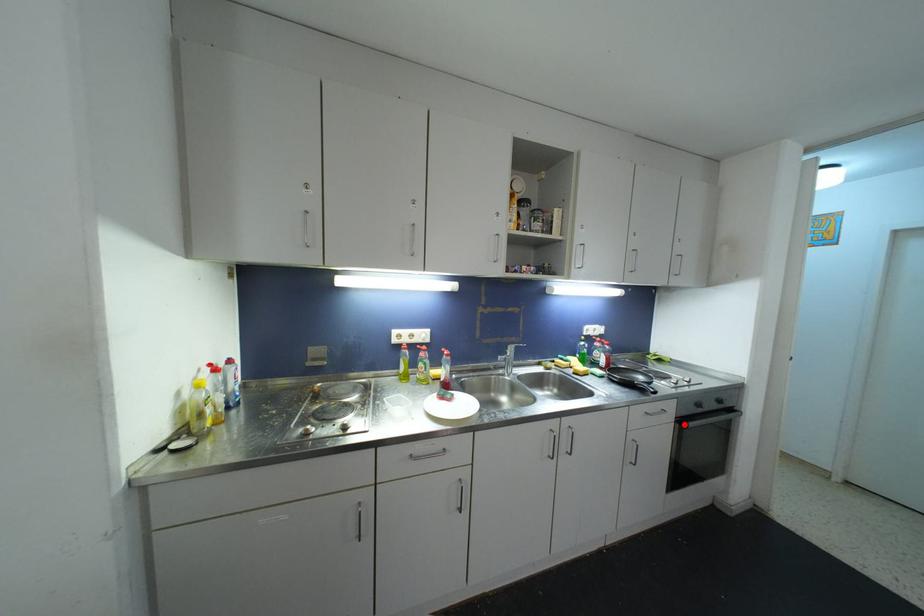
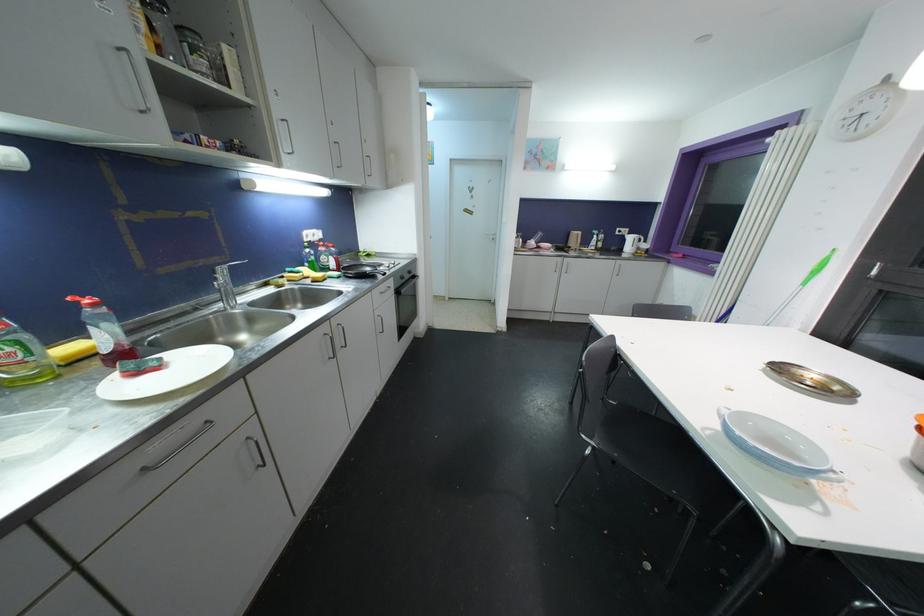
Where in the second image is the point corresponding to the highlighted location from the first image?

(400, 294)